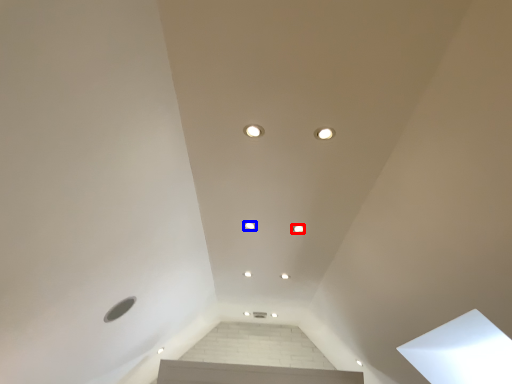
Question: Which object appears closest to the camera in this image, dot (highlighted by a red box) or dot (highlighted by a blue box)?

Choices:
 (A) dot
 (B) dot

Answer: (A)